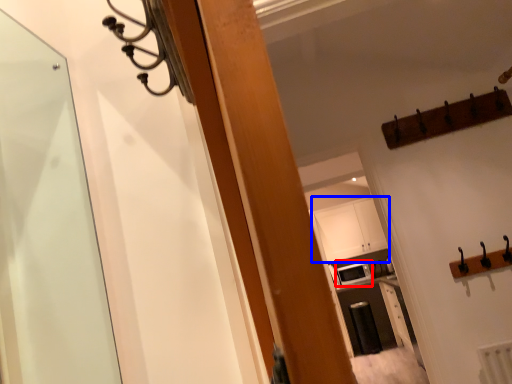
Question: Which object is further to the camera taking this photo, appliance (highlighted by a red box) or cabinetry (highlighted by a blue box)?

Choices:
 (A) appliance
 (B) cabinetry

Answer: (B)